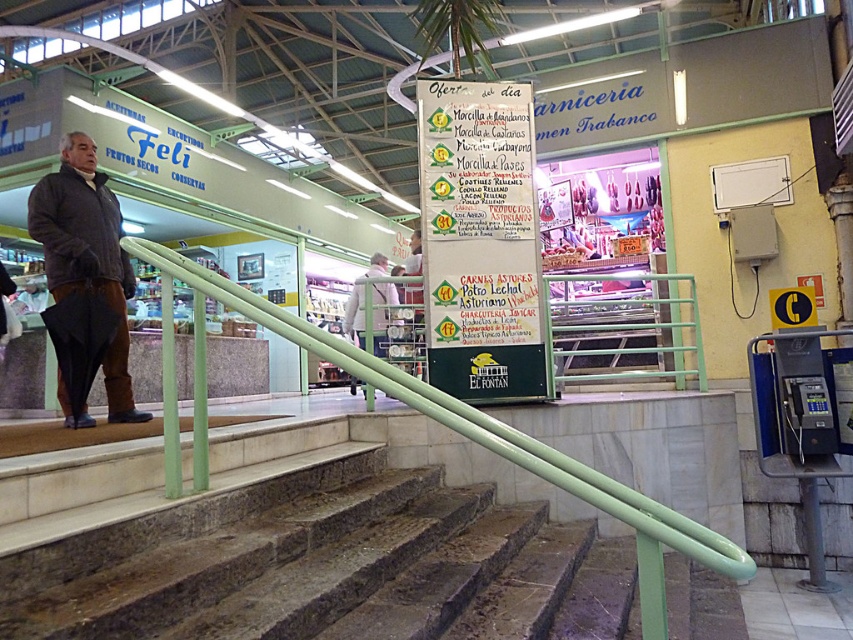
Is the position of green marble stairs at center more distant than that of light gray fabric jacket at center?

No.

Between point (618, 611) and point (352, 321), which one is positioned behind?

The point (352, 321) is behind.

The width and height of the screenshot is (853, 640). Identify the location of green marble stairs at center. (328, 564).

Is green marble stairs at center above dark gray jacket at left?

Actually, green marble stairs at center is below dark gray jacket at left.

Is point (242, 566) more distant than point (112, 417)?

That is False.

Between point (312, 476) and point (86, 284), which one is positioned behind?

The point (86, 284) is more distant.

The image size is (853, 640). I want to click on green marble stairs at center, so click(328, 564).

Describe the element at coordinates (86, 253) in the screenshot. The width and height of the screenshot is (853, 640). I see `dark gray jacket at left` at that location.

Can you confirm if dark gray jacket at left is positioned above light gray fabric jacket at center?

Yes.

Does point (105, 179) come closer to viewer compared to point (360, 314)?

Yes, it is.

Find the location of a particular element. The width and height of the screenshot is (853, 640). dark gray jacket at left is located at coordinates (86, 253).